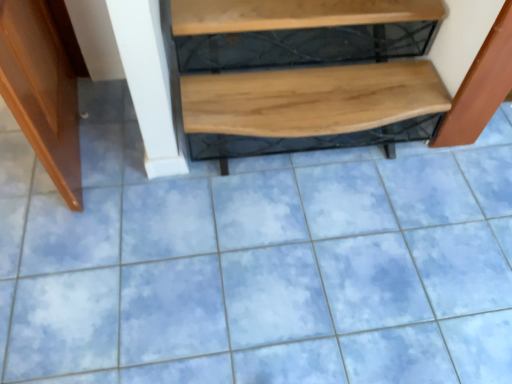
Question: Is point (400, 23) closer or farther from the camera than point (486, 87)?

Choices:
 (A) farther
 (B) closer

Answer: (A)

Question: From their relative heights in the image, would you say wooden at upper center is taller or shorter than wooden bench at right?

Choices:
 (A) short
 (B) tall

Answer: (A)

Question: Which of these objects is positioned farthest from the wooden bench at right?

Choices:
 (A) shiny brown door at left
 (B) natural wood bench at center
 (C) wooden at upper center

Answer: (A)

Question: Estimate the real-world distances between objects in this image. Which object is closer to the wooden at upper center?

Choices:
 (A) wooden bench at right
 (B) natural wood bench at center
 (C) shiny brown door at left

Answer: (B)